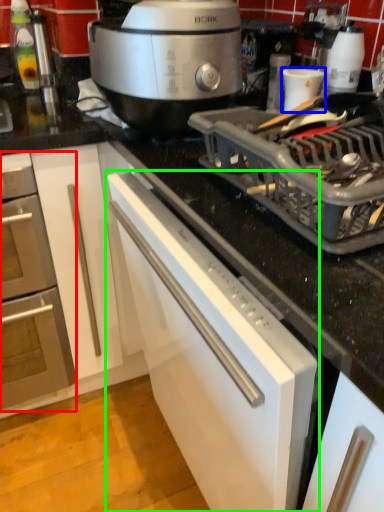
Question: Based on their relative distances, which object is nearer to home appliance (highlighted by a red box)? Choose from appliance (highlighted by a blue box) and cabinetry (highlighted by a green box).

Choices:
 (A) appliance
 (B) cabinetry

Answer: (B)